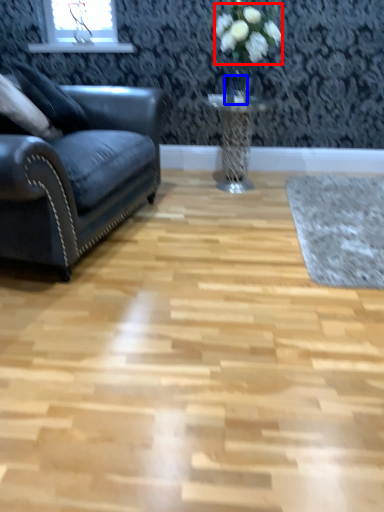
Question: Which point is further to the camera, flower (highlighted by a red box) or glass vase (highlighted by a blue box)?

Choices:
 (A) flower
 (B) glass vase

Answer: (B)